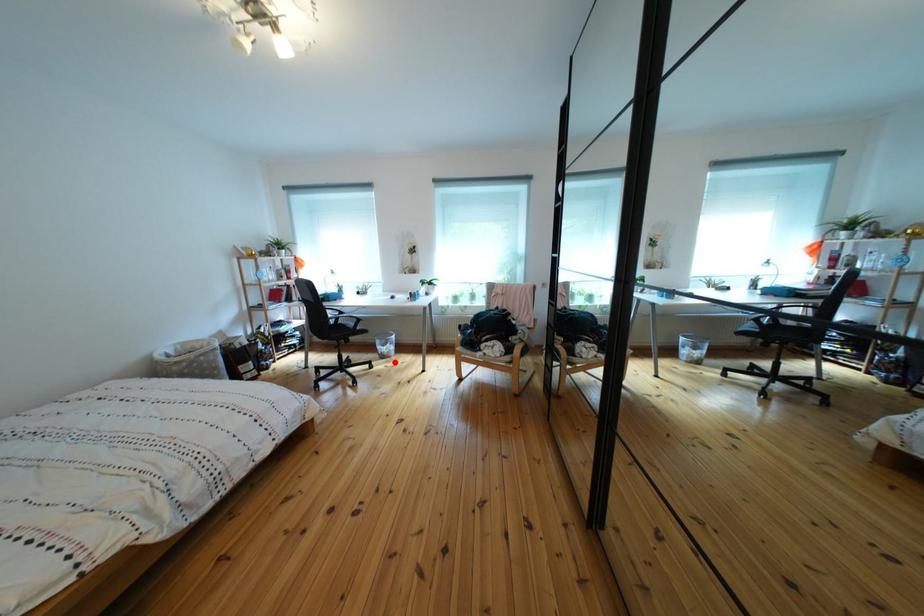
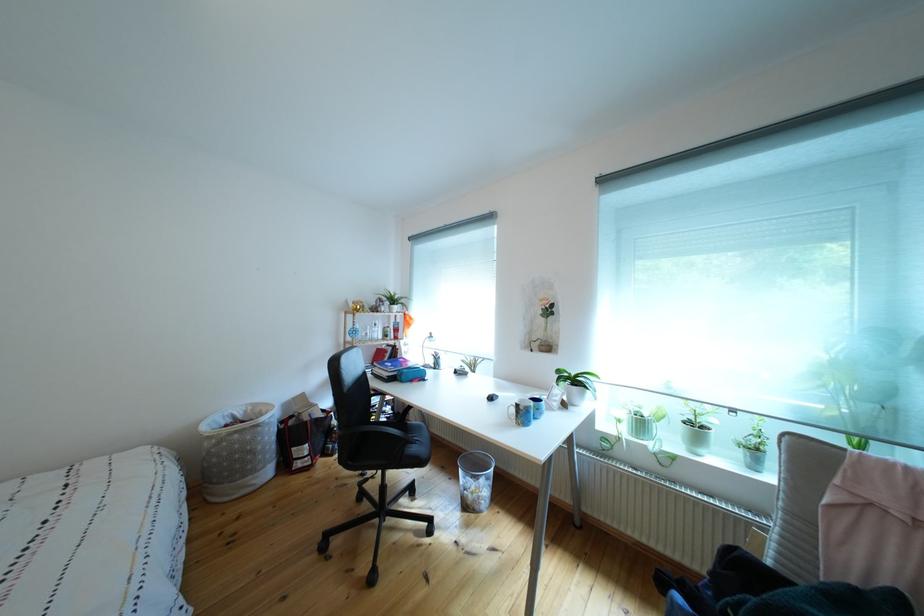
Question: I am providing you with two images of the same scene from different viewpoints. A red point is shown in image1. For the corresponding object point in image2, is it positioned nearer or farther from the camera?

Choices:
 (A) Nearer
 (B) Farther

Answer: (B)